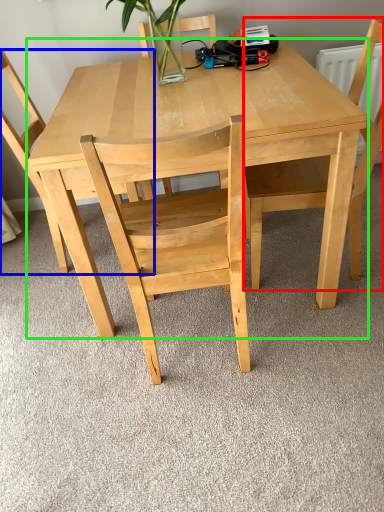
Question: Estimate the real-world distances between objects in this image. Which object is farther from chair (highlighted by a red box), chair (highlighted by a blue box) or table (highlighted by a green box)?

Choices:
 (A) chair
 (B) table

Answer: (A)